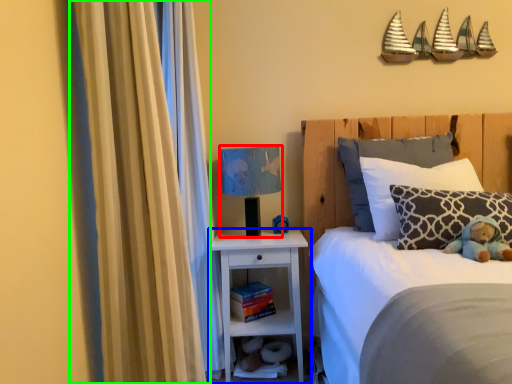
Question: Considering the real-world distances, which object is farthest from table lamp (highlighted by a red box)? nightstand (highlighted by a blue box) or curtain (highlighted by a green box)?

Choices:
 (A) nightstand
 (B) curtain

Answer: (B)